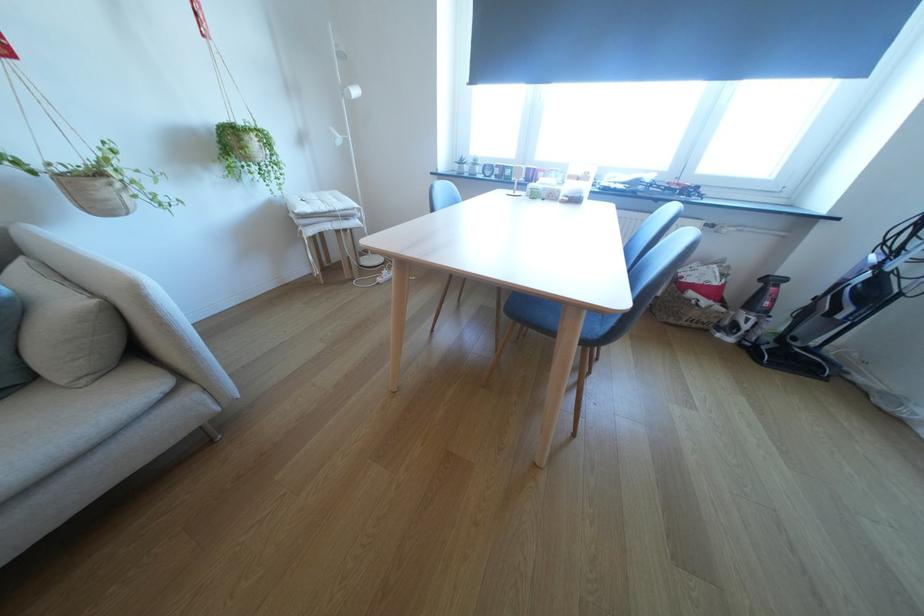
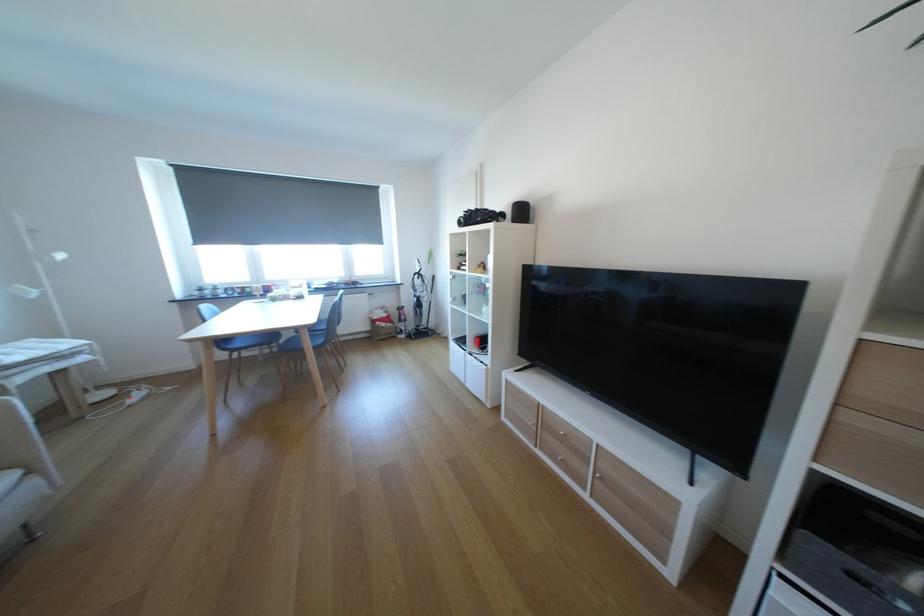
Locate, in the second image, the point that corresponds to point 201,399 in the first image.

(45, 483)